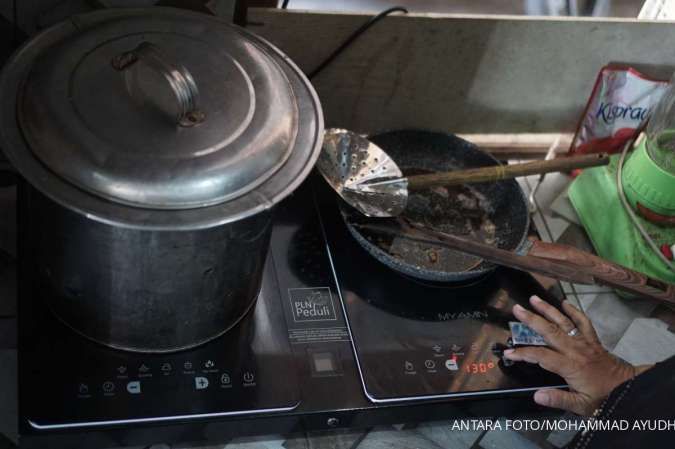
The height and width of the screenshot is (449, 675). What are the coordinates of `background wall` in the screenshot? It's located at (414, 83).